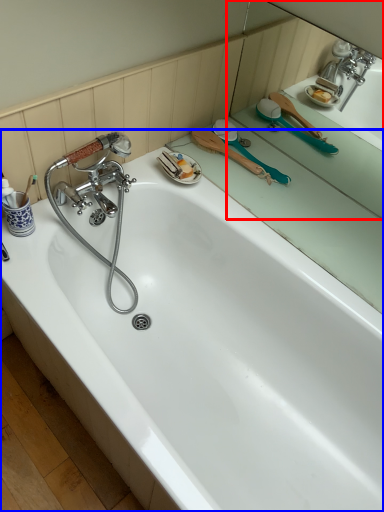
Question: Which object appears closest to the camera in this image, mirror (highlighted by a red box) or bathtub (highlighted by a blue box)?

Choices:
 (A) mirror
 (B) bathtub

Answer: (B)